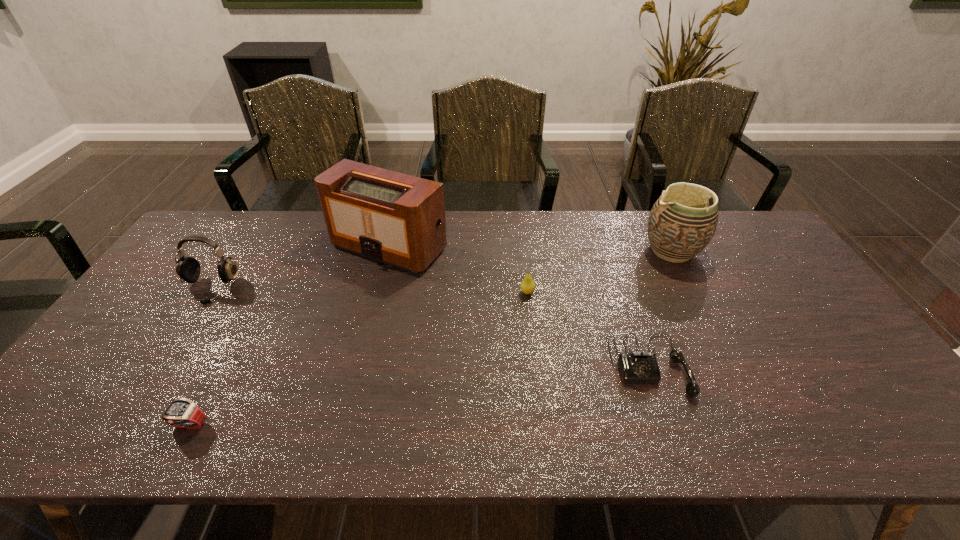
Locate an element on the screen. The width and height of the screenshot is (960, 540). free space between the rightmost object and the telephone is located at coordinates (660, 308).

The width and height of the screenshot is (960, 540). I want to click on vacant region between the nearest object and the second nearest object, so click(x=420, y=396).

Identify the location of free space between the fourth object from left to right and the radio receiver. (458, 269).

Locate an element on the screen. The height and width of the screenshot is (540, 960). object that can be found as the fourth closest to the watch is located at coordinates (636, 367).

Select which object appears as the closest to the pear. Please provide its 2D coordinates. Your answer should be formatted as a tuple, i.e. [(x, y)], where the tuple contains the x and y coordinates of a point satisfying the conditions above.

[(636, 367)]

Where is `blank space that satisfies the following two spatial constraints: 1. with the microphone on the side of the third tallest object; 2. on the left side of the watch`? This screenshot has height=540, width=960. blank space that satisfies the following two spatial constraints: 1. with the microphone on the side of the third tallest object; 2. on the left side of the watch is located at coordinates (120, 426).